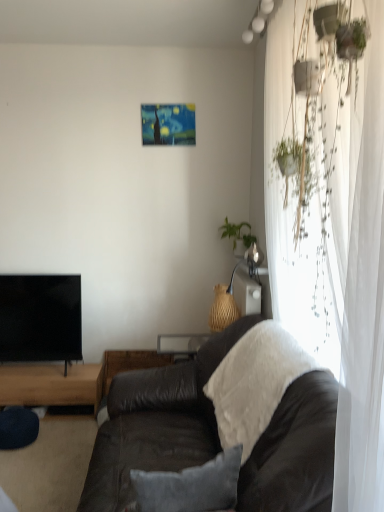
Locate an element on the screen. The height and width of the screenshot is (512, 384). free point below black glossy tv at left (from a real-world perspective) is located at coordinates (37, 364).